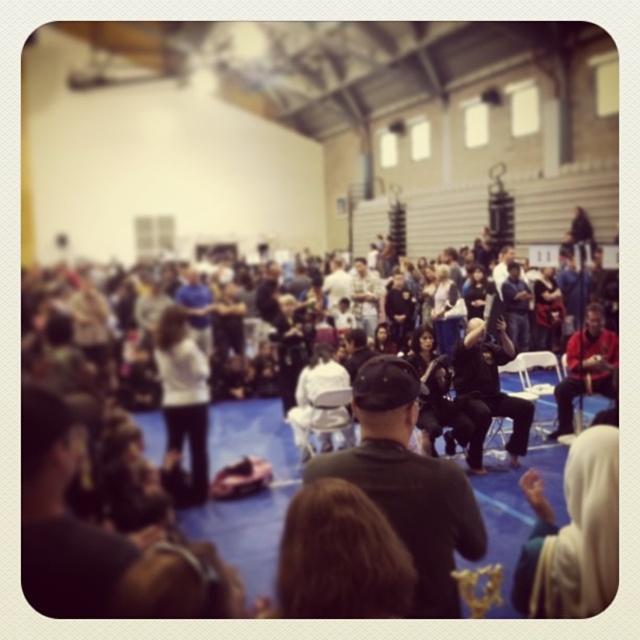
Which is below, white fabric at lower right or black matte jacket at center?

white fabric at lower right is lower down.

Can you confirm if white fabric at lower right is smaller than black matte jacket at center?

Yes.

Is point (588, 451) farther from camera compared to point (497, 358)?

That is False.

Identify the location of white fabric at lower right. (573, 534).

Can you confirm if white matte shirt at center is bigger than black matte jacket at center?

Yes, white matte shirt at center is bigger than black matte jacket at center.

Is point (189, 369) positioned after point (468, 380)?

No, (189, 369) is in front of (468, 380).

Where is `white matte shirt at center`? The image size is (640, 640). white matte shirt at center is located at coordinates (182, 396).

Can you confirm if matte black cap at lower left is bigger than reddish-brown leather jacket at right?

No, matte black cap at lower left is not bigger than reddish-brown leather jacket at right.

Is matte black cap at lower left to the right of reddish-brown leather jacket at right from the viewer's perspective?

Incorrect, matte black cap at lower left is not on the right side of reddish-brown leather jacket at right.

What do you see at coordinates (61, 518) in the screenshot?
I see `matte black cap at lower left` at bounding box center [61, 518].

This screenshot has width=640, height=640. Find the location of `matte black cap at lower left`. matte black cap at lower left is located at coordinates (61, 518).